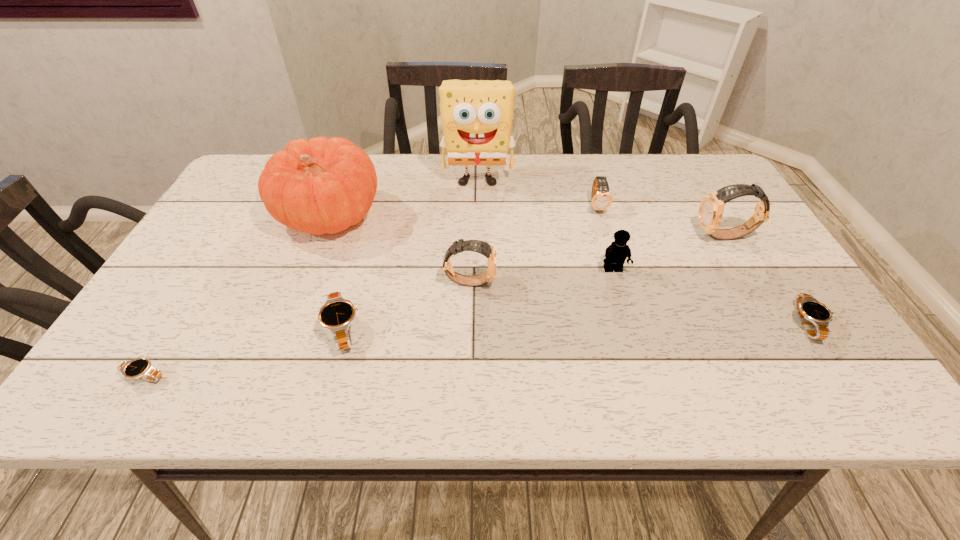
Where is `watch that is at the far edge`? watch that is at the far edge is located at coordinates (601, 199).

Where is `object positioned at the near edge`? object positioned at the near edge is located at coordinates (141, 368).

You are a GUI agent. You are given a task and a screenshot of the screen. Output one action in this format:
    pyautogui.click(x=<x>, y=<y>)
    Task: Click on the object that is at the left edge
    
    Given the screenshot: What is the action you would take?
    pyautogui.click(x=141, y=368)

At what (x,y) coordinates should I click in order to perform the action: click on object that is at the near left corner. Please return your answer as a coordinate pair (x, y). The width and height of the screenshot is (960, 540). Looking at the image, I should click on (141, 368).

Identify the location of blank space at the far edge of the desktop. The height and width of the screenshot is (540, 960). (558, 155).

In the image, there is a desktop. Where is `vacant space at the near edge`? vacant space at the near edge is located at coordinates (316, 380).

Identify the location of blank space at the right edge of the desktop. This screenshot has height=540, width=960. [x=740, y=241].

I want to click on free space at the near right corner, so click(865, 404).

Locate an element on the screen. vacant point located between the rightmost black watch and the third farthest watch is located at coordinates (638, 302).

The height and width of the screenshot is (540, 960). I want to click on vacant area between the third watch from left to right and the tallest watch, so click(x=597, y=259).